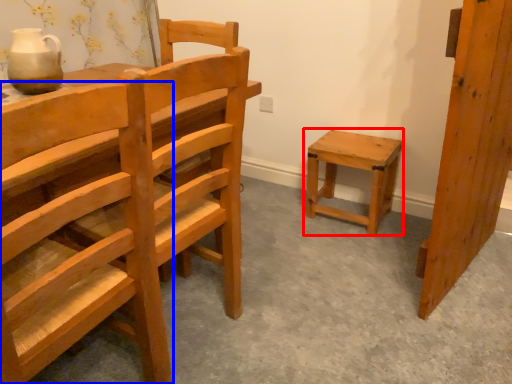
Question: Which of the following is the farthest to the observer, stool (highlighted by a red box) or chair (highlighted by a blue box)?

Choices:
 (A) stool
 (B) chair

Answer: (A)